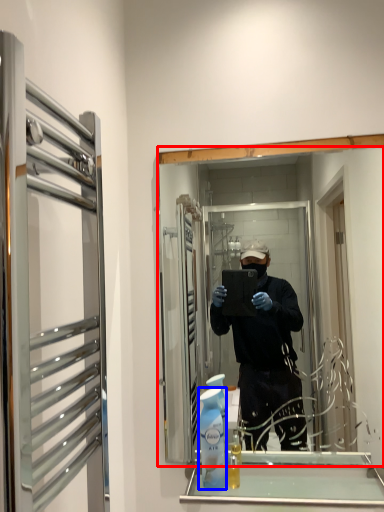
Question: Among these objects, which one is farthest to the camera, mirror (highlighted by a red box) or cleaning product (highlighted by a blue box)?

Choices:
 (A) mirror
 (B) cleaning product

Answer: (A)